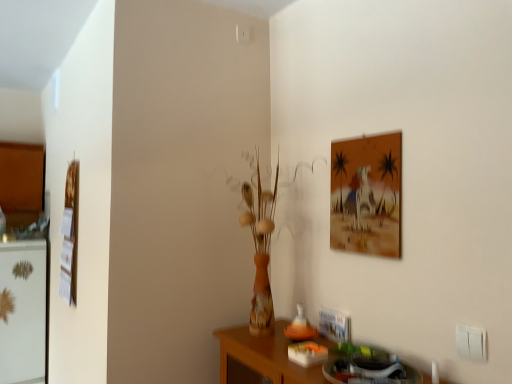
Question: Is white glossy fridge at left not inside matte orange painting at upper right, acting as the 1th picture frame starting from the right?

Choices:
 (A) no
 (B) yes

Answer: (B)

Question: Is white glossy fridge at left facing away from matte orange painting at upper right, the 1th picture frame when ordered from front to back?

Choices:
 (A) yes
 (B) no

Answer: (B)

Question: Is white glossy fridge at left far from matte orange painting at upper right, acting as the 1th picture frame starting from the right?

Choices:
 (A) no
 (B) yes

Answer: (B)

Question: Is the position of white glossy fridge at left less distant than that of matte orange painting at upper right, acting as the 1th picture frame starting from the right?

Choices:
 (A) yes
 (B) no

Answer: (B)

Question: Considering the relative sizes of white glossy fridge at left and matte orange painting at upper right, acting as the 1th picture frame starting from the right, in the image provided, is white glossy fridge at left thinner than matte orange painting at upper right, acting as the 1th picture frame starting from the right,?

Choices:
 (A) no
 (B) yes

Answer: (A)

Question: From a real-world perspective, is white glossy fridge at left beneath matte orange painting at upper right, acting as the 1th picture frame starting from the right?

Choices:
 (A) no
 (B) yes

Answer: (B)

Question: Can you confirm if matte orange painting at upper right, the 1th picture frame when ordered from front to back, is bigger than white glossy fridge at left?

Choices:
 (A) yes
 (B) no

Answer: (B)

Question: Does matte orange painting at upper right, which appears as the second picture frame when viewed from the back, turn towards white glossy fridge at left?

Choices:
 (A) yes
 (B) no

Answer: (B)

Question: Can you confirm if matte orange painting at upper right, which is the second picture frame from left to right, is taller than white glossy fridge at left?

Choices:
 (A) yes
 (B) no

Answer: (B)

Question: Can you confirm if matte orange painting at upper right, the 1th picture frame when ordered from front to back, is positioned to the right of white glossy fridge at left?

Choices:
 (A) yes
 (B) no

Answer: (A)

Question: Is matte orange painting at upper right, which appears as the second picture frame when viewed from the back, in contact with white glossy fridge at left?

Choices:
 (A) yes
 (B) no

Answer: (B)

Question: From the image's perspective, is matte orange painting at upper right, acting as the 1th picture frame starting from the right, on white glossy fridge at left?

Choices:
 (A) yes
 (B) no

Answer: (A)

Question: Is matte orange painting at upper right, acting as the 1th picture frame starting from the right, completely or partially outside of wooden picture frame at left, the 2th picture frame in the right-to-left sequence?

Choices:
 (A) no
 (B) yes

Answer: (B)